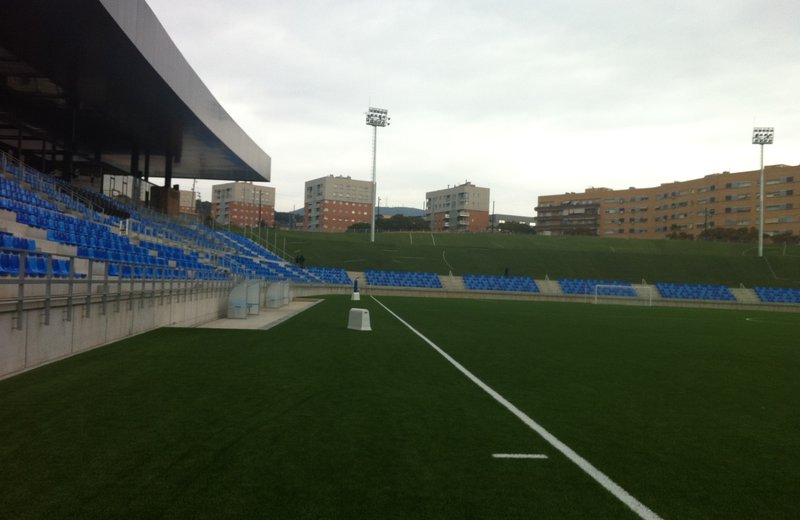
This screenshot has height=520, width=800. I want to click on lights, so click(374, 113), click(769, 138).